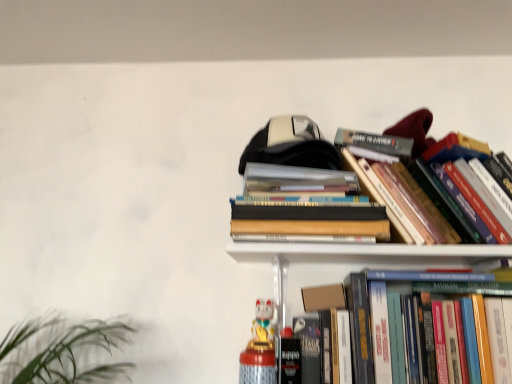
Question: Is point (250, 362) positioned closer to the camera than point (399, 382)?

Choices:
 (A) farther
 (B) closer

Answer: (A)

Question: In terms of height, does white glossy cat figurine at lower center look taller or shorter compared to hardcover book at center right, the third book in the top-to-bottom sequence?

Choices:
 (A) short
 (B) tall

Answer: (A)

Question: Which is nearer to the hardcover book at center right, positioned as the 1th book in bottom-to-top order?

Choices:
 (A) hardcover books at upper right, which appears as the 1th book when viewed from the top
 (B) cardboard box at upper center
 (C) white glossy cat figurine at lower center
 (D) hardcover books at upper center, which is counted as the 2th book, starting from the top

Answer: (B)

Question: Based on their relative distances, which object is farther from the hardcover books at upper right, which appears as the 1th book when viewed from the top?

Choices:
 (A) hardcover book at center right, the third book in the top-to-bottom sequence
 (B) hardcover books at upper center, which is counted as the 2th book, starting from the top
 (C) cardboard box at upper center
 (D) white glossy cat figurine at lower center

Answer: (D)